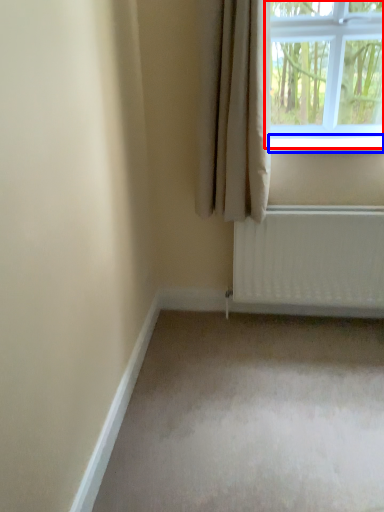
Question: Which point is closer to the camera, window (highlighted by a red box) or window sill (highlighted by a blue box)?

Choices:
 (A) window
 (B) window sill

Answer: (A)